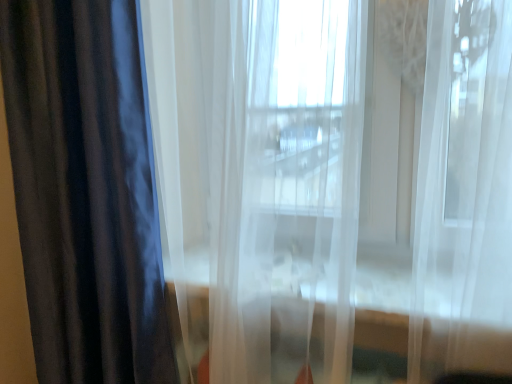
At what (x,y) coordinates should I click in order to perform the action: click on dark blue velvet curtain at left. Please return your answer as a coordinate pair (x, y). The height and width of the screenshot is (384, 512). Looking at the image, I should click on (85, 191).

Image resolution: width=512 pixels, height=384 pixels. What do you see at coordinates (85, 191) in the screenshot? I see `dark blue velvet curtain at left` at bounding box center [85, 191].

Locate an element on the screen. This screenshot has height=384, width=512. dark blue velvet curtain at left is located at coordinates (85, 191).